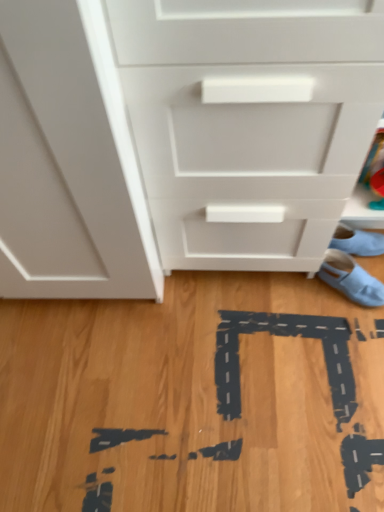
Question: Is light blue fabric shoe at lower right, which is counted as the 1th footwear, starting from the bottom, taller or shorter than light blue fabric shoe at lower right, which is counted as the 1th footwear, starting from the top?

Choices:
 (A) tall
 (B) short

Answer: (B)

Question: Considering their positions, is light blue fabric shoe at lower right, which is counted as the 1th footwear, starting from the bottom, located in front of or behind light blue fabric shoe at lower right, which is counted as the 1th footwear, starting from the top?

Choices:
 (A) behind
 (B) front

Answer: (B)

Question: Based on their relative distances, which object is nearer to the white matte chest of drawers at center?

Choices:
 (A) light blue fabric shoe at lower right, marked as the second footwear in a bottom-to-top arrangement
 (B) light blue fabric shoe at lower right, which is counted as the 1th footwear, starting from the bottom

Answer: (B)

Question: Which is nearer to the light blue fabric shoe at lower right, marked as the second footwear in a bottom-to-top arrangement?

Choices:
 (A) white matte chest of drawers at center
 (B) light blue fabric shoe at lower right, which is counted as the 1th footwear, starting from the bottom

Answer: (B)